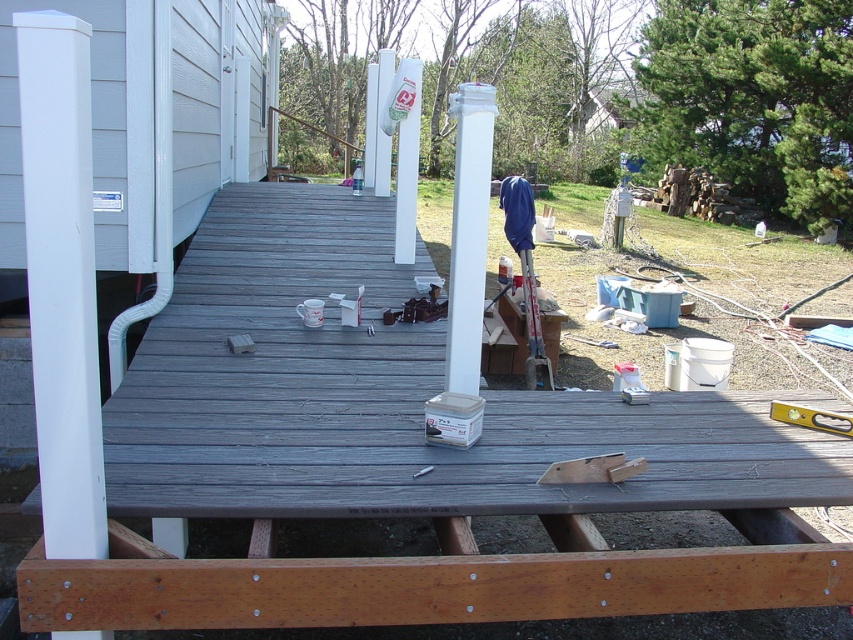
You are a contractor assessing the deck structure. You need to determine which post has a greater width for stability purposes. Which post is wider between the white painted wood post at left and the white glossy post at center?

The white painted wood post at left is wider than the white glossy post at center, so it has greater width for stability purposes.

You are standing at the point with coordinates point (74, 349) and want to walk towards the point with coordinates point (459, 340). Based on the scene description, will you be moving towards the house or away from it?

Since point (74, 349) is in front of point (459, 340), moving from point (74, 349) towards point (459, 340) means you are moving away from the house.

You are standing on the partially constructed wooden deck and looking towards the house. Which post, the white painted wood post at left or the white glossy post at center, is closer to you?

The white painted wood post at left is closer to the viewer than the white glossy post at center, so the white painted wood post at left is closer to you.